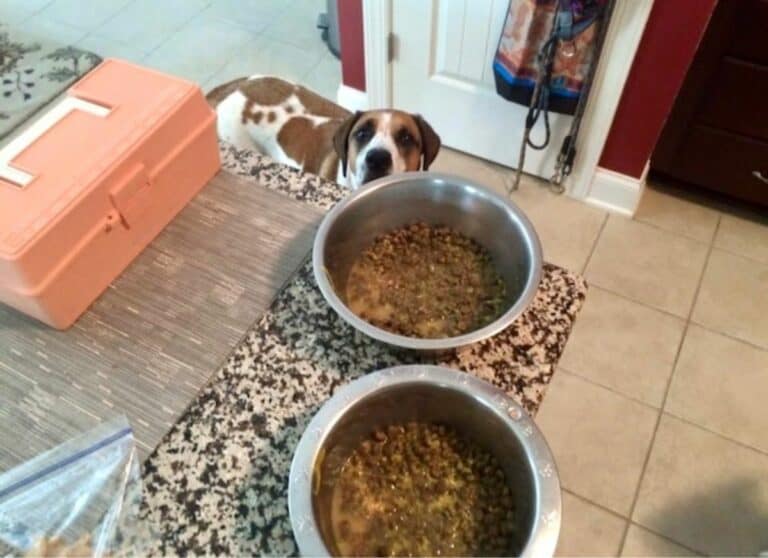
Locate an element on the screen. red wall is located at coordinates (349, 33), (672, 65).